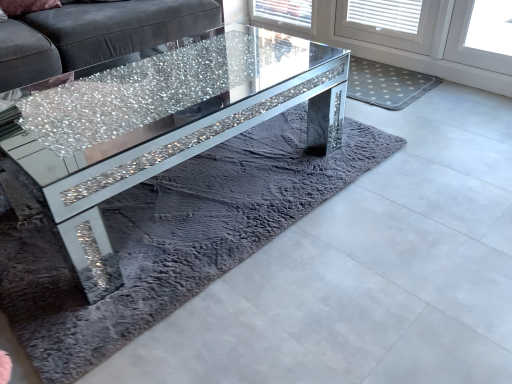
Question: In terms of size, does crystalline glass coffee table at center appear bigger or smaller than sparkly glass table at center?

Choices:
 (A) big
 (B) small

Answer: (B)

Question: From the image's perspective, is crystalline glass coffee table at center above or below sparkly glass table at center?

Choices:
 (A) above
 (B) below

Answer: (B)

Question: Considering the positions of point (197, 140) and point (216, 84), is point (197, 140) closer or farther from the camera than point (216, 84)?

Choices:
 (A) farther
 (B) closer

Answer: (B)

Question: Does point (70, 155) appear closer or farther from the camera than point (333, 114)?

Choices:
 (A) farther
 (B) closer

Answer: (B)

Question: Is sparkly glass table at center wider or thinner than crystalline glass coffee table at center?

Choices:
 (A) wide
 (B) thin

Answer: (A)

Question: Based on their positions, is sparkly glass table at center located to the left or right of crystalline glass coffee table at center?

Choices:
 (A) right
 (B) left

Answer: (B)

Question: In terms of size, does sparkly glass table at center appear bigger or smaller than crystalline glass coffee table at center?

Choices:
 (A) small
 (B) big

Answer: (B)